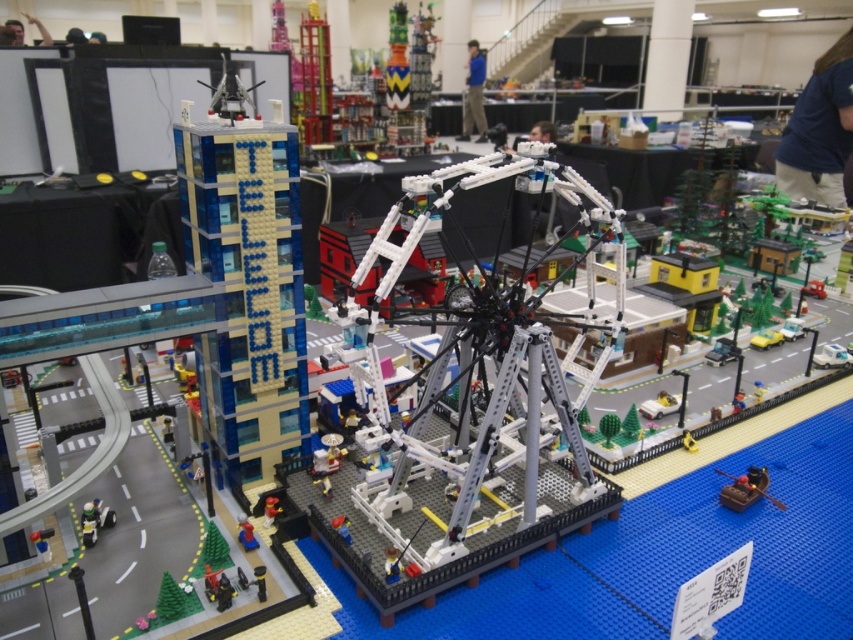
You are standing in front of the Lego exhibition and want to take a photo of the matte brown canoe at lower right. If your camera can focus on objects up to 6 feet away, will it be able to capture the canoe clearly?

The matte brown canoe at lower right is 5.74 feet away from the viewer, so yes, the camera can focus on it since the distance is within the 6 feet range.

You are standing at the entrance of the Lego exhibition and see two points marked in the scene. The first point is at coordinate point (762,477) and the second is at point (830,364). Which point is closer to you?

Point (762,477) is in front of point (830,364), so it is closer to you.